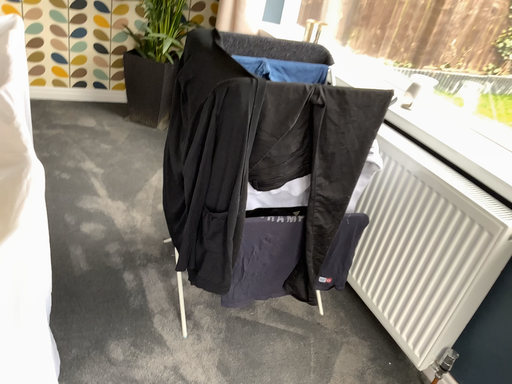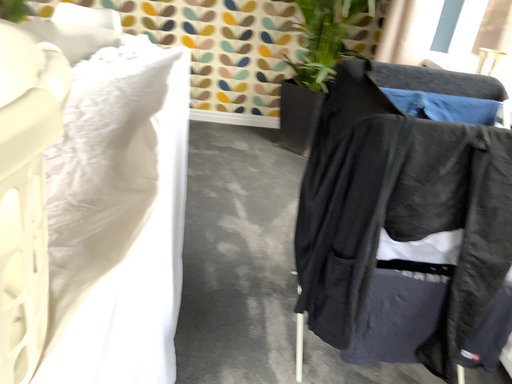
Question: Which way did the camera rotate in the video?

Choices:
 (A) rotated left
 (B) rotated right

Answer: (A)